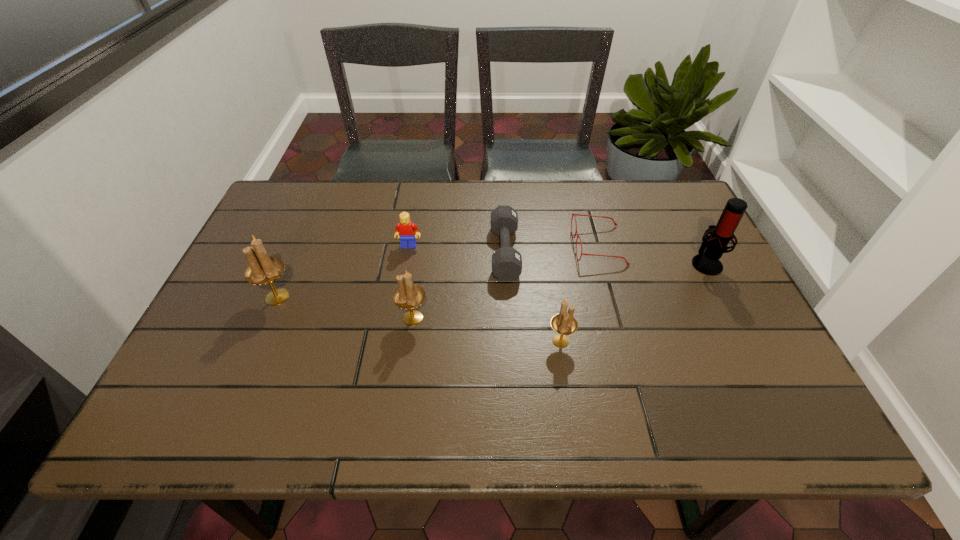
Please point a free position for a candle holder on the right. Please provide its 2D coordinates. Your answer should be formatted as a tuple, i.e. [(x, y)], where the tuple contains the x and y coordinates of a point satisfying the conditions above.

[(723, 366)]